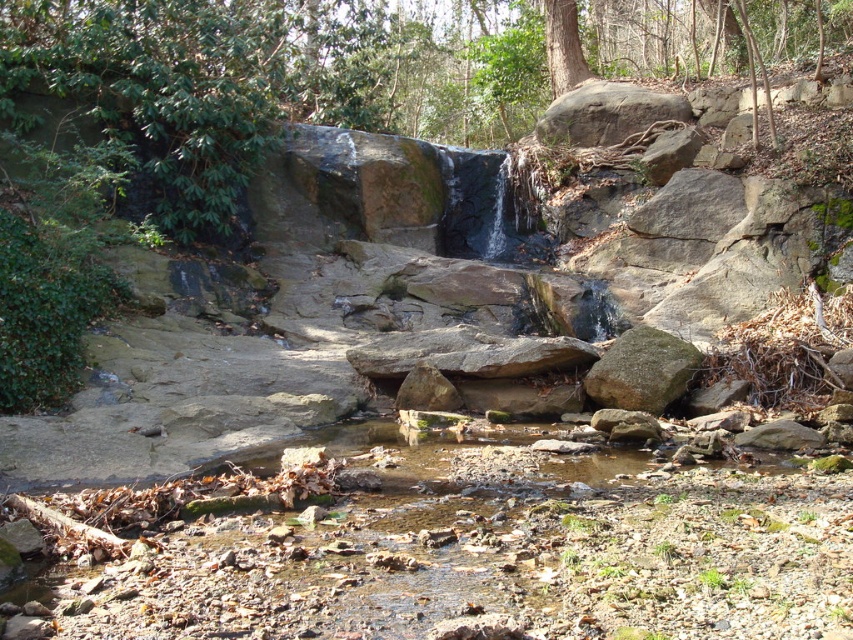
Question: Which object is closer to the camera taking this photo?

Choices:
 (A) green mossy rock at center-right
 (B) green leafy tree at upper center

Answer: (A)

Question: Is green leafy tree at upper center thinner than green mossy rock at center-right?

Choices:
 (A) no
 (B) yes

Answer: (A)

Question: Which object is farther from the camera taking this photo?

Choices:
 (A) green leafy tree at upper center
 (B) green mossy rock at center-right

Answer: (A)

Question: Which point is closer to the camera taking this photo?

Choices:
 (A) (641, 352)
 (B) (352, 13)

Answer: (A)

Question: Is green leafy tree at upper center to the left of green mossy rock at center-right from the viewer's perspective?

Choices:
 (A) yes
 (B) no

Answer: (A)

Question: Does green leafy tree at upper center have a larger size compared to green mossy rock at center-right?

Choices:
 (A) no
 (B) yes

Answer: (B)